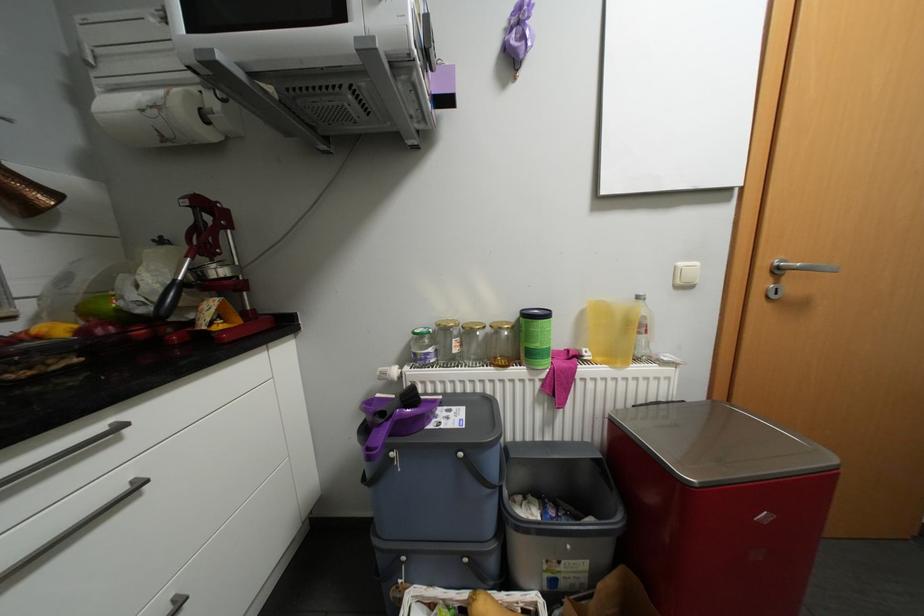
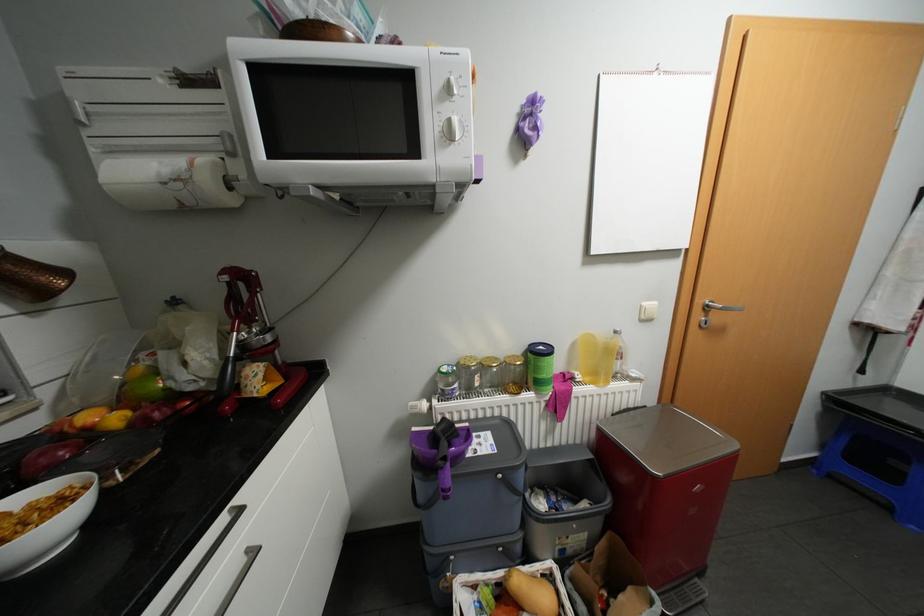
Find the pixel in the second image that matches (685,286) in the first image.

(649, 320)